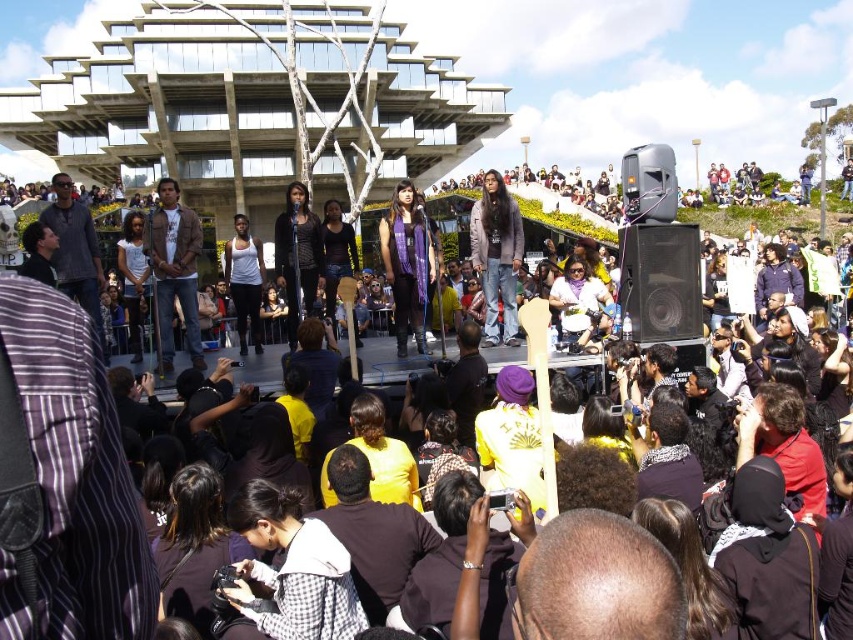
You are attending an outdoor event in front of a modern building. You see a point marked at coordinates (659, 282). What object is located at that point?

The point at coordinates (659, 282) marks the location of the black matte speaker at center.

You are standing at the front of the crowd and want to take a photo of both the brown leather jacket at center and the purple scarf at center. Which item will appear larger in your photo?

The brown leather jacket at center will appear larger in the photo because it is closer to the viewer than the purple scarf at center.